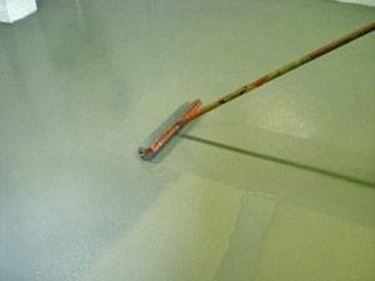
Locate an element on the screen. broom handle is located at coordinates (281, 71).